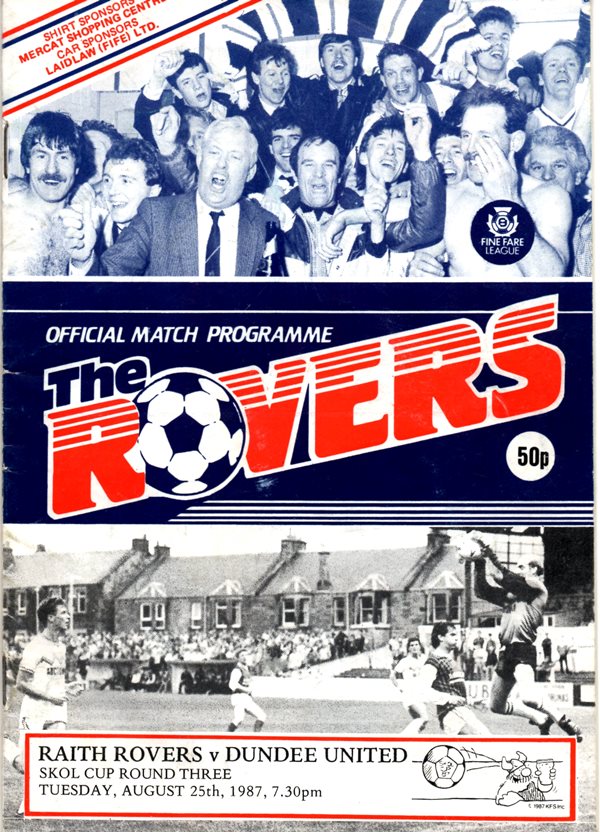
In order to click on cup in this screenshot , I will do `click(94, 775)`.